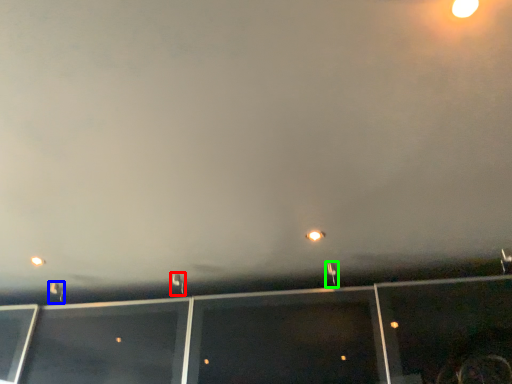
Question: Which object is the farthest from street light (highlighted by a red box)? Choose among these: street light (highlighted by a blue box) or street light (highlighted by a green box).

Choices:
 (A) street light
 (B) street light

Answer: (B)